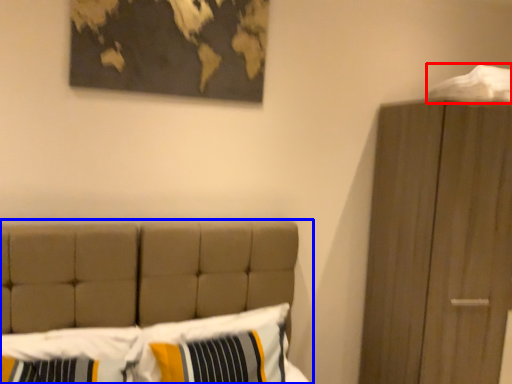
Question: Among these objects, which one is nearest to the camera, sheet (highlighted by a red box) or bed (highlighted by a blue box)?

Choices:
 (A) sheet
 (B) bed

Answer: (B)